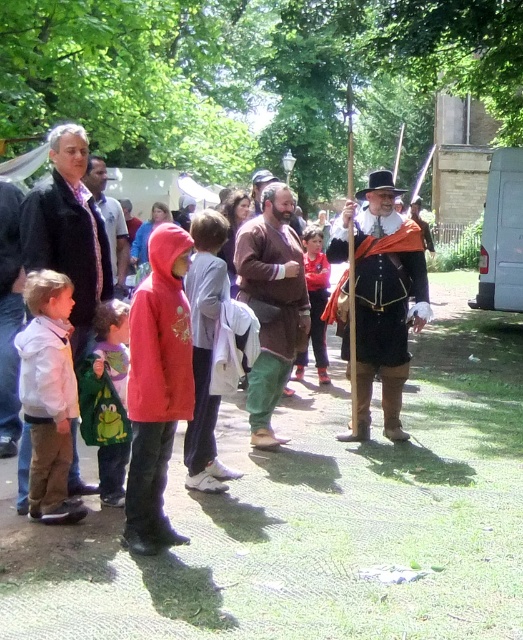
You are a photographer trying to capture a group photo of the white matte shirt at left and the light gray hoodie at center. Which person should you focus on to ensure they appear larger in the photo?

You should focus on the light gray hoodie at center because it occupies more space in the frame than the white matte shirt at left.

From the picture: You are a photographer at the event and want to capture both the dark gray jacket at center and the brown leather tunic at center in a single shot. Which direction should you move to ensure both are visible in your frame?

You should move to the right side so that both the dark gray jacket at center and the brown leather tunic at center are visible in your frame since the dark gray jacket at center is on the left side of the brown leather tunic at center.